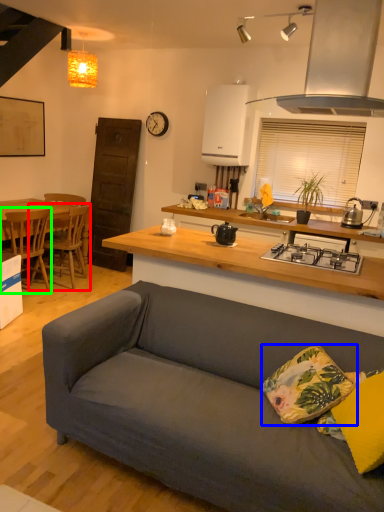
Question: Which is farther away from chair (highlighted by a red box)? pillow (highlighted by a blue box) or chair (highlighted by a green box)?

Choices:
 (A) pillow
 (B) chair

Answer: (A)